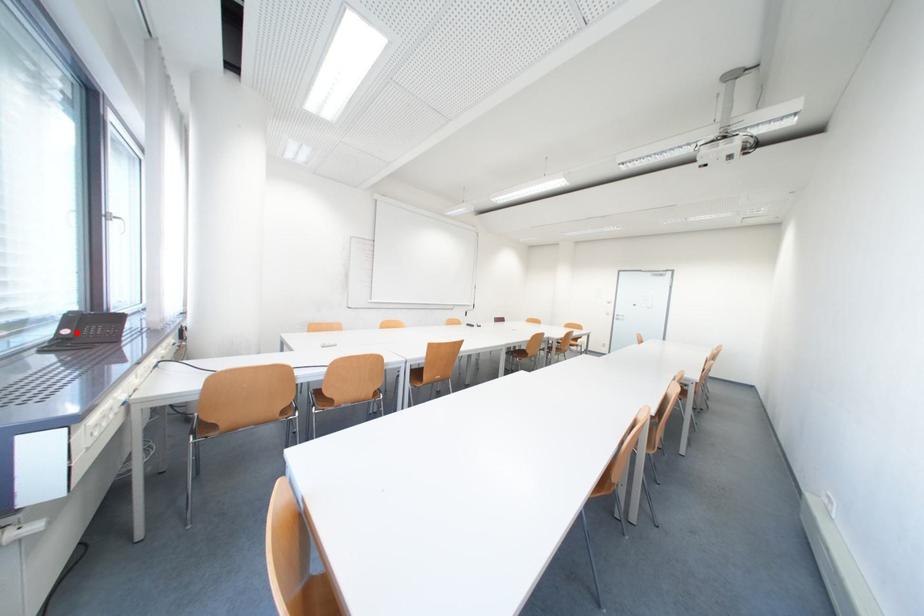
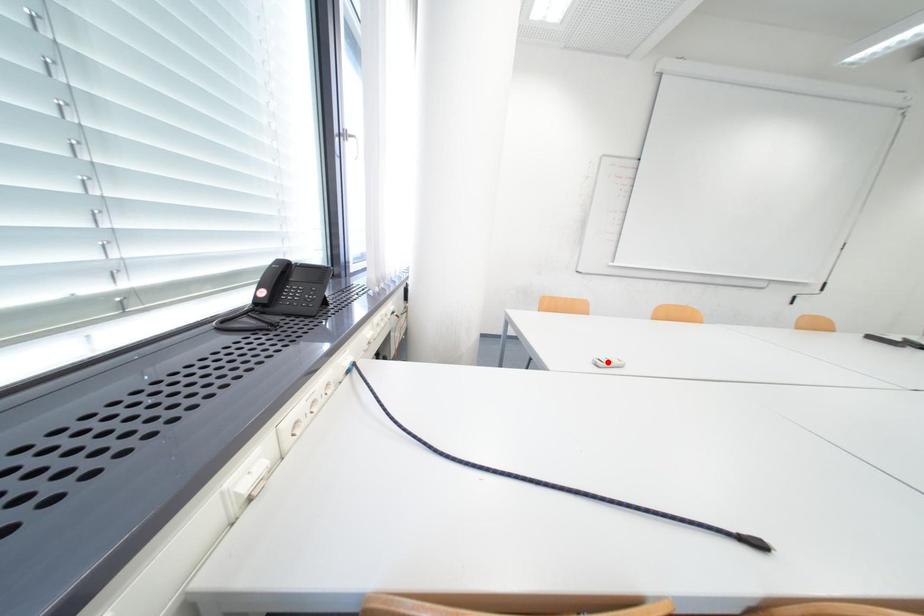
I am providing you with two images of the same scene from different viewpoints. A red point is marked on the first image and another point is marked on the second image. Does the point marked in image1 correspond to the same location as the one in image2?

No